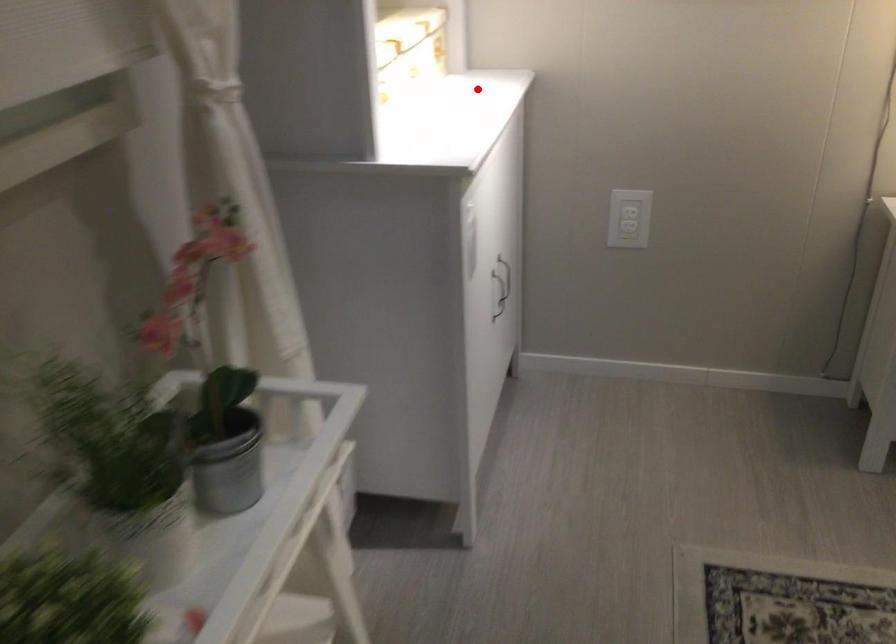
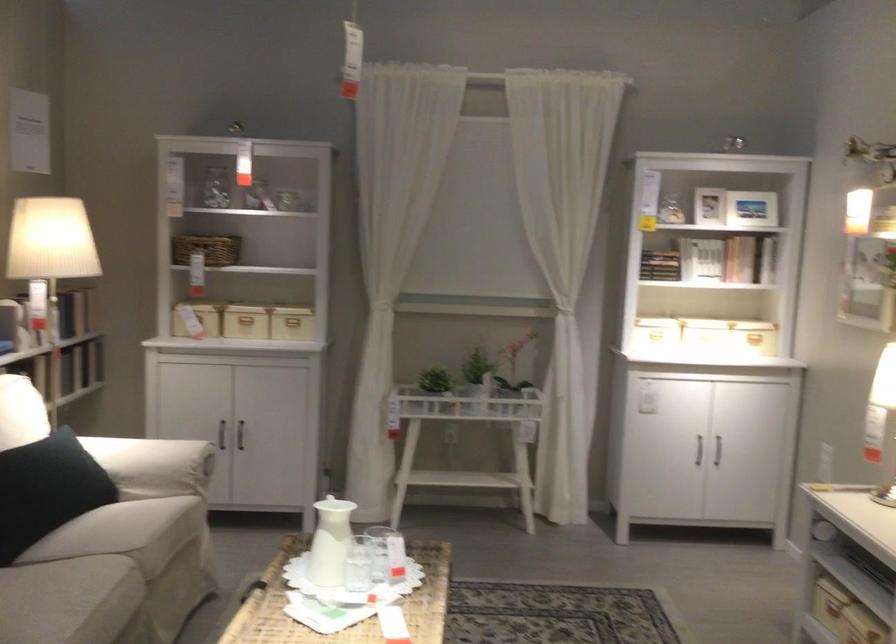
Locate, in the second image, the point that corresponds to the highlighted location in the first image.

(755, 339)